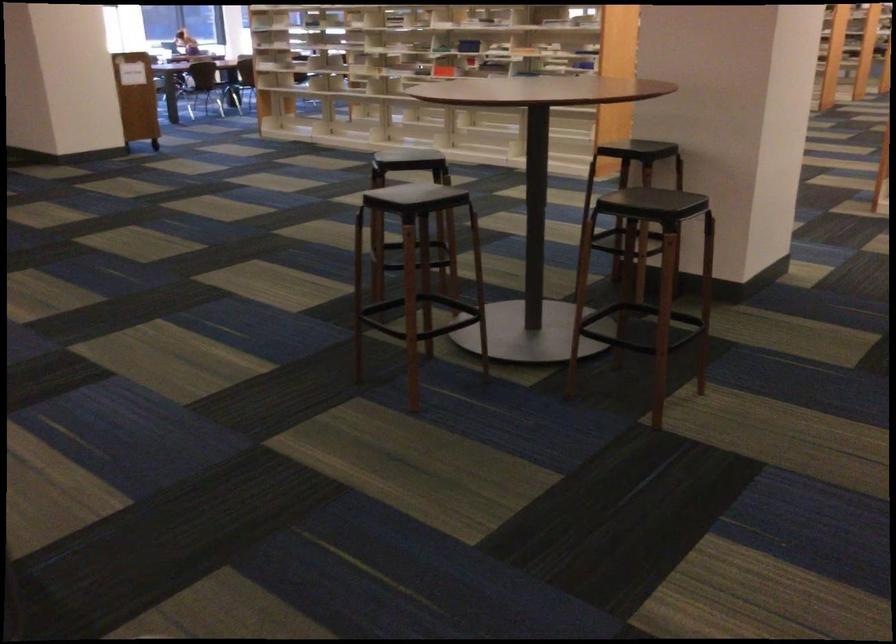
Find where to push the wheeled book cart. Please return your answer as a coordinate pair (x, y).

(418, 75)